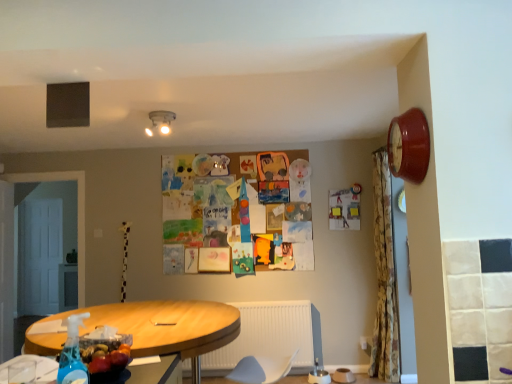
The width and height of the screenshot is (512, 384). What do you see at coordinates (162, 120) in the screenshot?
I see `matte white ceiling light at upper center` at bounding box center [162, 120].

The width and height of the screenshot is (512, 384). Describe the element at coordinates (261, 369) in the screenshot. I see `light blue fabric swivel chair at lower center` at that location.

What do you see at coordinates (72, 354) in the screenshot?
I see `blue translucent spray bottle at lower left` at bounding box center [72, 354].

The height and width of the screenshot is (384, 512). What do you see at coordinates (384, 277) in the screenshot?
I see `floral fabric shower curtain at right` at bounding box center [384, 277].

This screenshot has width=512, height=384. I want to click on shiny plastic bottle of water at lower left, so click(x=106, y=355).

Based on their sizes in the image, would you say blue translucent spray bottle at lower left is bigger or smaller than matte white ceiling light at upper center?

Considering their sizes, blue translucent spray bottle at lower left takes up less space than matte white ceiling light at upper center.

Does blue translucent spray bottle at lower left have a lesser height compared to matte white ceiling light at upper center?

No.

This screenshot has width=512, height=384. What are the coordinates of `lamp above the blue translucent spray bottle at lower left (from a real-world perspective)` in the screenshot? It's located at (162, 120).

Which point is more distant from viewer, (250, 362) or (422, 117)?

Positioned behind is point (250, 362).

Looking at their sizes, would you say light blue fabric swivel chair at lower center is wider or thinner than matte red clock at upper right?

In the image, light blue fabric swivel chair at lower center appears to be wider than matte red clock at upper right.

You are a GUI agent. You are given a task and a screenshot of the screen. Output one action in this format:
    pyautogui.click(x=<x>, y=<y>)
    Task: Click on the clock located above the light blue fabric swivel chair at lower center (from a real-world perspective)
    The width and height of the screenshot is (512, 384).
    Given the screenshot: What is the action you would take?
    pyautogui.click(x=409, y=146)

Between light blue fabric swivel chair at lower center and matte red clock at upper right, which one is positioned behind?

light blue fabric swivel chair at lower center is more distant.

Is matte white ceiling light at upper center aimed at blue translucent spray bottle at lower left?

No.

Would you say matte white ceiling light at upper center is to the left or to the right of blue translucent spray bottle at lower left in the picture?

From the image, it's evident that matte white ceiling light at upper center is to the left of blue translucent spray bottle at lower left.

From the image's perspective, is matte white ceiling light at upper center above blue translucent spray bottle at lower left?

Correct, matte white ceiling light at upper center appears higher than blue translucent spray bottle at lower left in the image.

Does point (417, 179) appear closer or farther from the camera than point (53, 337)?

Point (417, 179).

From a real-world perspective, is matte red clock at upper right on top of wooden table at lower left?

Correct, in the physical world, matte red clock at upper right is higher than wooden table at lower left.

Is matte red clock at upper right behind wooden table at lower left?

That is False.

Is matte red clock at upper right wider or thinner than wooden table at lower left?

Clearly, matte red clock at upper right has less width compared to wooden table at lower left.

Is floral fabric shower curtain at right turned away from blue translucent spray bottle at lower left?

That's not correct — floral fabric shower curtain at right is not looking away from blue translucent spray bottle at lower left.

In the scene shown: From a real-world perspective, which is physically below, floral fabric shower curtain at right or blue translucent spray bottle at lower left?

blue translucent spray bottle at lower left, from a real-world perspective.

In terms of size, does floral fabric shower curtain at right appear bigger or smaller than blue translucent spray bottle at lower left?

floral fabric shower curtain at right is bigger than blue translucent spray bottle at lower left.

Is floral fabric shower curtain at right spatially inside blue translucent spray bottle at lower left, or outside of it?

floral fabric shower curtain at right is outside blue translucent spray bottle at lower left.

Are blue translucent spray bottle at lower left and light blue fabric swivel chair at lower center far apart?

Yes, blue translucent spray bottle at lower left and light blue fabric swivel chair at lower center are quite far apart.

Measure the distance from blue translucent spray bottle at lower left to light blue fabric swivel chair at lower center.

blue translucent spray bottle at lower left and light blue fabric swivel chair at lower center are 2.03 meters apart.

Between blue translucent spray bottle at lower left and light blue fabric swivel chair at lower center, which one has smaller width?

blue translucent spray bottle at lower left.

From the picture: Which of these two, blue translucent spray bottle at lower left or light blue fabric swivel chair at lower center, is bigger?

Bigger between the two is light blue fabric swivel chair at lower center.

Does matte red clock at upper right have a lesser width compared to floral fabric shower curtain at right?

Yes.

Does matte red clock at upper right appear on the left side of floral fabric shower curtain at right?

Yes, matte red clock at upper right is to the left of floral fabric shower curtain at right.

Would you consider matte red clock at upper right to be distant from floral fabric shower curtain at right?

Yes, matte red clock at upper right and floral fabric shower curtain at right are quite far apart.

Where is `shower curtain on the right of matte red clock at upper right`? shower curtain on the right of matte red clock at upper right is located at coordinates (384, 277).

At what (x,y) coordinates should I click in order to perform the action: click on lamp above the blue translucent spray bottle at lower left (from the image's perspective). Please return your answer as a coordinate pair (x, y). Looking at the image, I should click on (162, 120).

At what (x,y) coordinates should I click in order to perform the action: click on clock in front of the light blue fabric swivel chair at lower center. Please return your answer as a coordinate pair (x, y). The width and height of the screenshot is (512, 384). Looking at the image, I should click on (409, 146).

Looking at the image, which one is located further to floral fabric shower curtain at right, wooden table at lower left or blue translucent spray bottle at lower left?

blue translucent spray bottle at lower left is positioned further to the anchor floral fabric shower curtain at right.

Looking at the image, which one is located closer to matte white ceiling light at upper center, light blue fabric swivel chair at lower center or shiny plastic bottle of water at lower left?

shiny plastic bottle of water at lower left is closer to matte white ceiling light at upper center.

When comparing their distances from blue translucent spray bottle at lower left, does matte white ceiling light at upper center or floral fabric shower curtain at right seem closer?

The object closer to blue translucent spray bottle at lower left is matte white ceiling light at upper center.

From the image, which object appears to be farther from floral fabric shower curtain at right, shiny plastic bottle of water at lower left or matte white ceiling light at upper center?

shiny plastic bottle of water at lower left is positioned further to the anchor floral fabric shower curtain at right.

Based on their spatial positions, is floral fabric shower curtain at right or shiny plastic bottle of water at lower left closer to blue translucent spray bottle at lower left?

Based on the image, shiny plastic bottle of water at lower left appears to be nearer to blue translucent spray bottle at lower left.

Based on their spatial positions, is blue translucent spray bottle at lower left or floral fabric shower curtain at right further from light blue fabric swivel chair at lower center?

blue translucent spray bottle at lower left lies further to light blue fabric swivel chair at lower center than the other object.

Based on their spatial positions, is matte red clock at upper right or matte white ceiling light at upper center further from shiny plastic bottle of water at lower left?

matte white ceiling light at upper center is further to shiny plastic bottle of water at lower left.

Based on their spatial positions, is matte red clock at upper right or light blue fabric swivel chair at lower center further from matte white ceiling light at upper center?

light blue fabric swivel chair at lower center is further to matte white ceiling light at upper center.

I want to click on clock between blue translucent spray bottle at lower left and floral fabric shower curtain at right from front to back, so click(409, 146).

Where is `food between blue translucent spray bottle at lower left and wooden table at lower left in the front-back direction`? food between blue translucent spray bottle at lower left and wooden table at lower left in the front-back direction is located at coordinates (106, 355).

Where is `table between shiny plastic bottle of water at lower left and matte red clock at upper right`? This screenshot has height=384, width=512. table between shiny plastic bottle of water at lower left and matte red clock at upper right is located at coordinates (167, 326).

Where is `table located between matte red clock at upper right and matte white ceiling light at upper center in the depth direction`? table located between matte red clock at upper right and matte white ceiling light at upper center in the depth direction is located at coordinates (167, 326).